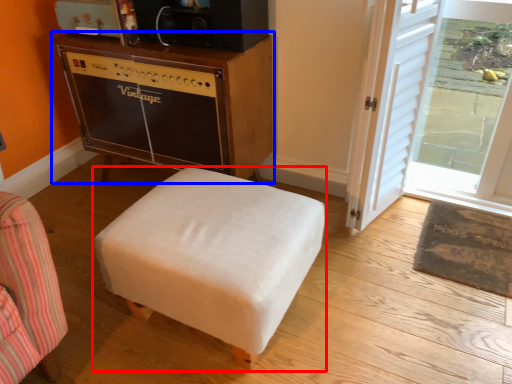
Question: Which object is closer to the camera taking this photo, furniture (highlighted by a red box) or table (highlighted by a blue box)?

Choices:
 (A) furniture
 (B) table

Answer: (A)